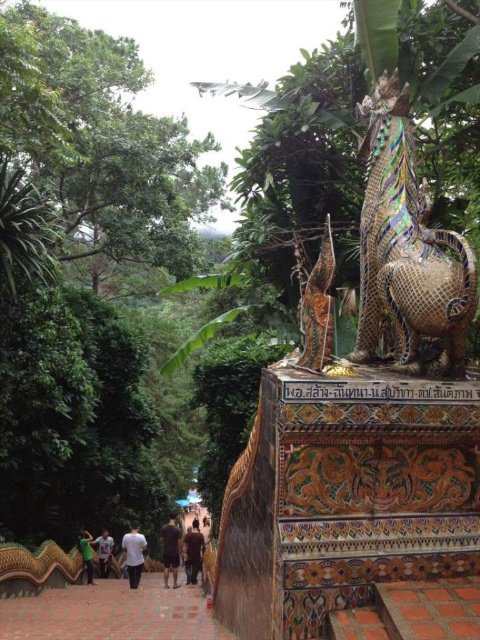
You are a tour guide leading a group through this temple site. You notice two visitors wearing the dark brown cotton shirt at center and the white matte shirt at lower center. You want to ensure they stay within the 2 meter social distancing guideline. Are they currently following the guideline?

The distance between the dark brown cotton shirt at center and the white matte shirt at lower center is 1.99 meters, which is just below the 2 meter guideline. They are following the social distancing guideline as they are within the required distance.

You are a tourist visiting the temple and you want to take a photo of the statue. You are standing on the white matte shirt at lower center. Can you stand on the terracotta tile path at lower center to get a better angle? Explain why or why not.

The terracotta tile path at lower center is higher than the white matte shirt at lower center. Therefore, standing on the terracotta tile path at lower center would allow you to get a better angle as it is elevated compared to your current position on the white matte shirt at lower center.

You are standing in front of a temple structure with a mythical creature statue. You notice a terracotta tile path at lower center and a white matte shirt at lower center. Which object is nearer to you?

The terracotta tile path at lower center is closer to the viewer than the white matte shirt at lower center.